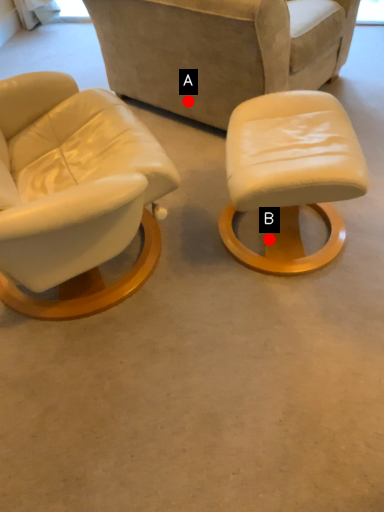
Question: Two points are circled on the image, labeled by A and B beside each circle. Which point appears farthest from the camera in this image?

Choices:
 (A) A is further
 (B) B is further

Answer: (A)